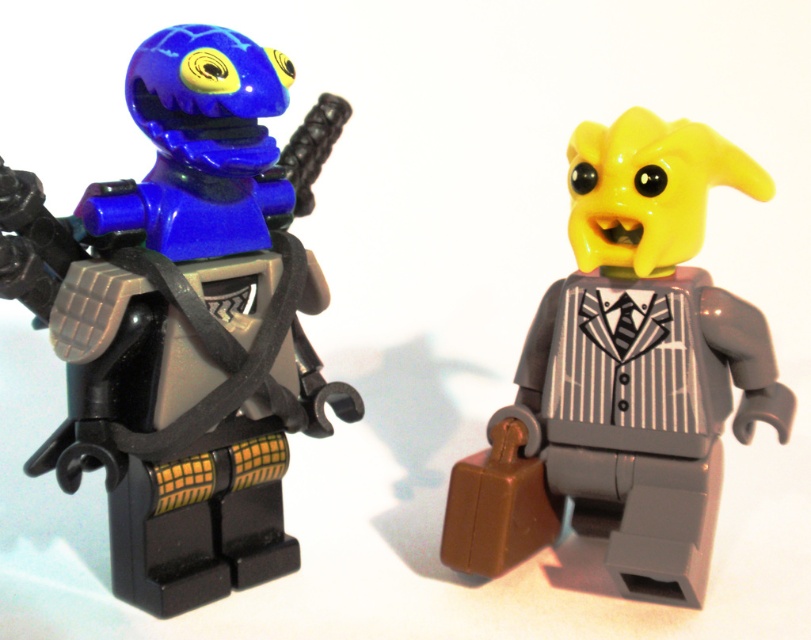
You are a photographer setting up a shot of the two LEGO minifigures. You want to position a spotlight exactly at the point marked by coordinates point (185, 317). Which part of the LEGO minifigures will the spotlight illuminate?

The point (185, 317) corresponds to the shiny blue helmet at left, so the spotlight will illuminate the shiny blue helmet at left.

Where is the shiny blue helmet at left located in the image?

The shiny blue helmet at left is located at point (185,317).

You are a LEGO collector examining the two minifigures. Which object is positioned higher in the image, the shiny blue helmet at left or the yellow matte suit at center?

The shiny blue helmet at left is positioned above the yellow matte suit at center, so it is higher in the image.